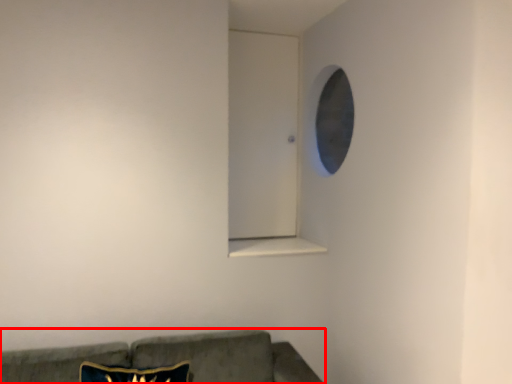
Question: From the image's perspective, where is studio couch (annotated by the red box) located in relation to window sill in the image?

Choices:
 (A) below
 (B) above

Answer: (A)